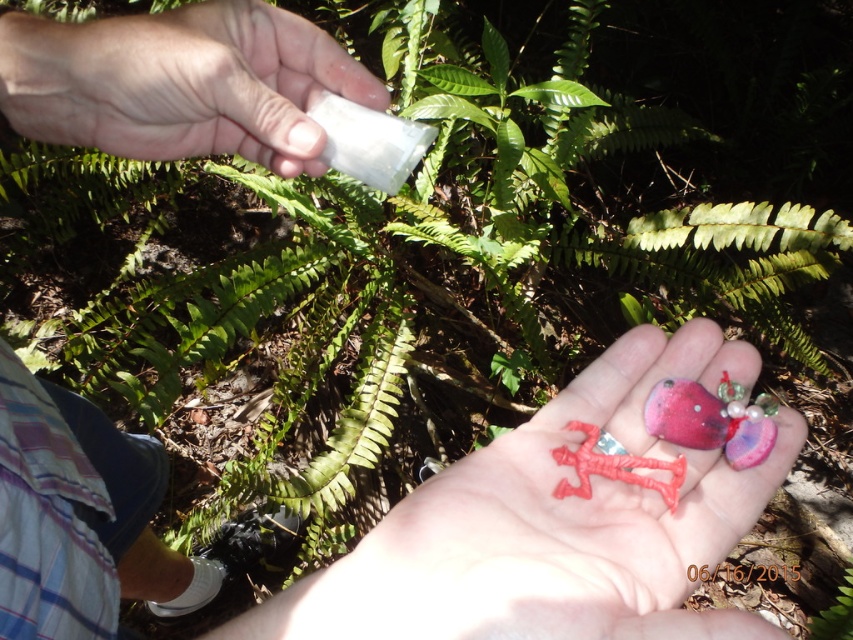
You are a child playing in the forest and you see the matte plastic toy at center and the white matte paper at upper left. Which one is closer to your right hand?

The matte plastic toy at center is to the right of the white matte paper at upper left, so it is closer to your right hand.

You are a delivery robot that needs to place a small package on the white matte paper at upper left. The package is 1 inch in diameter. Can you safely place it there without hitting the matte plastic toy at center?

The matte plastic toy at center is 9.34 inches away from the white matte paper at upper left. Since the package is only 1 inch in diameter, there is sufficient space between them to place the package safely without causing a collision.

You are an artist trying to arrange two items in a photo shoot. You have a white matte paper at upper left and a rubber man at center. Based on their sizes, which item should you place closer to the camera to ensure both appear roughly the same size in the final image?

The white matte paper at upper left is taller than the rubber man at center. To make them appear similar in size, move the rubber man at center closer to the camera while keeping the white matte paper at upper left farther back.